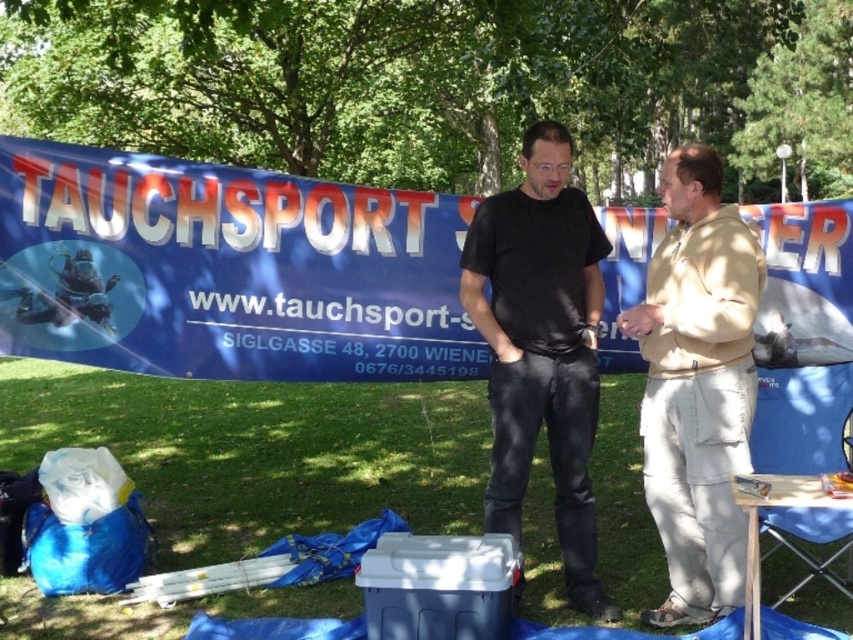
Question: Does beige cotton pants at right come behind black matte shirt at center?

Choices:
 (A) yes
 (B) no

Answer: (B)

Question: In this image, where is beige cotton pants at right located relative to black matte shirt at center?

Choices:
 (A) left
 (B) right

Answer: (B)

Question: Is beige cotton pants at right thinner than black matte shirt at center?

Choices:
 (A) no
 (B) yes

Answer: (B)

Question: Which point appears farthest from the camera in this image?

Choices:
 (A) (699, 250)
 (B) (535, 221)

Answer: (B)

Question: Which of the following is the closest to the observer?

Choices:
 (A) (497, 314)
 (B) (717, 541)

Answer: (B)

Question: Which of the following is the closest to the observer?

Choices:
 (A) (556, 390)
 (B) (686, 380)

Answer: (B)